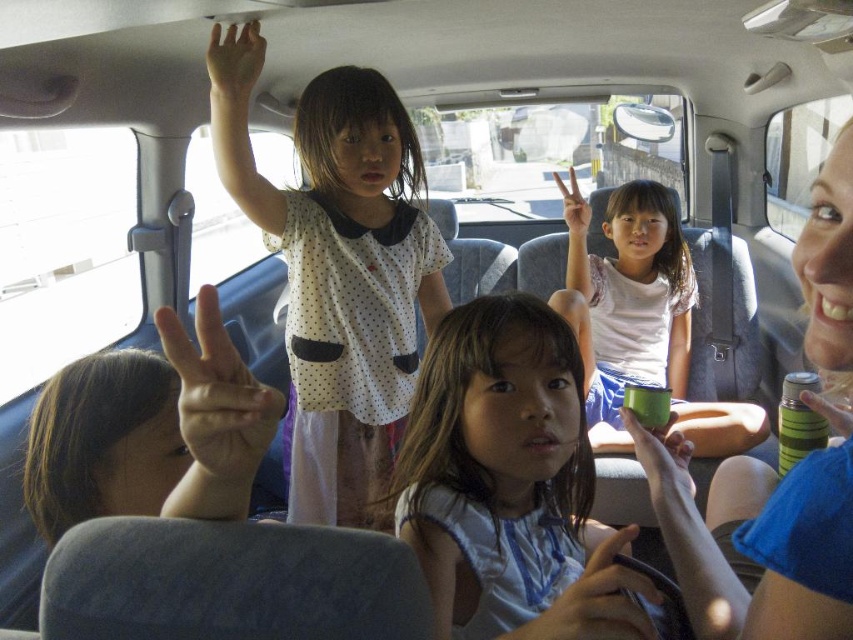
You are a passenger in the car and notice a white matte hand at center in the backseat. Where exactly is this hand located in terms of coordinates?

The white matte hand at center is located at coordinates point (218, 392).

You are a parent in the driver seat and want to hand a toy to your child. The toy is placed on the dashboard directly in front of you. However, you need to reach past the light blue fabric shirt at center and the green matte cup at center. Which object should you move first to access the toy?

You should move the light blue fabric shirt at center first because it is closer to you than the green matte cup at center, so moving it first will allow you to access the toy more easily.

You are a parent in the driver seat of the car. You notice the light blue fabric shirt at center and the matte green cup at center in the backseat. Which object is closer to the ceiling?

The light blue fabric shirt at center is shorter than the matte green cup at center, so the matte green cup at center is taller and closer to the ceiling.